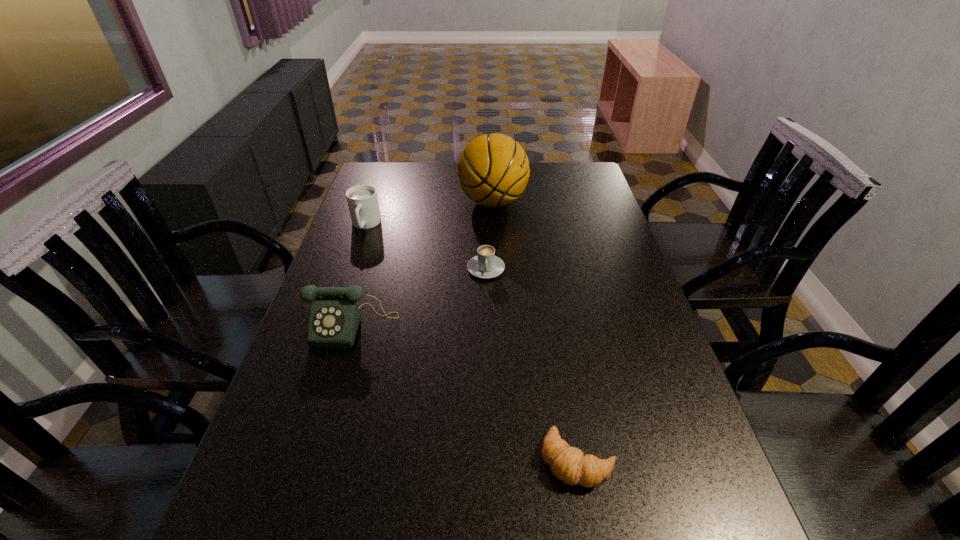
The image size is (960, 540). In order to click on the tallest object in this screenshot , I will do (493, 170).

The height and width of the screenshot is (540, 960). What are the coordinates of `the fourth farthest object` in the screenshot? It's located at (334, 317).

Where is `the left cappuccino`? the left cappuccino is located at coordinates (362, 200).

The image size is (960, 540). I want to click on the farther cappuccino, so click(x=362, y=200).

Locate an element on the screen. The height and width of the screenshot is (540, 960). the second shortest object is located at coordinates (486, 265).

The height and width of the screenshot is (540, 960). In order to click on the right cappuccino in this screenshot , I will do `click(486, 265)`.

The height and width of the screenshot is (540, 960). In order to click on the nearest object in this screenshot , I will do `click(569, 464)`.

Locate an element on the screen. This screenshot has width=960, height=540. crescent roll is located at coordinates point(569,464).

The width and height of the screenshot is (960, 540). Find the location of `free region located 0.250m on the surface of the basketball near the brand logo`. free region located 0.250m on the surface of the basketball near the brand logo is located at coordinates (389, 202).

This screenshot has height=540, width=960. In order to click on vacant space located on the surface of the basketball near the brand logo in this screenshot , I will do `click(392, 202)`.